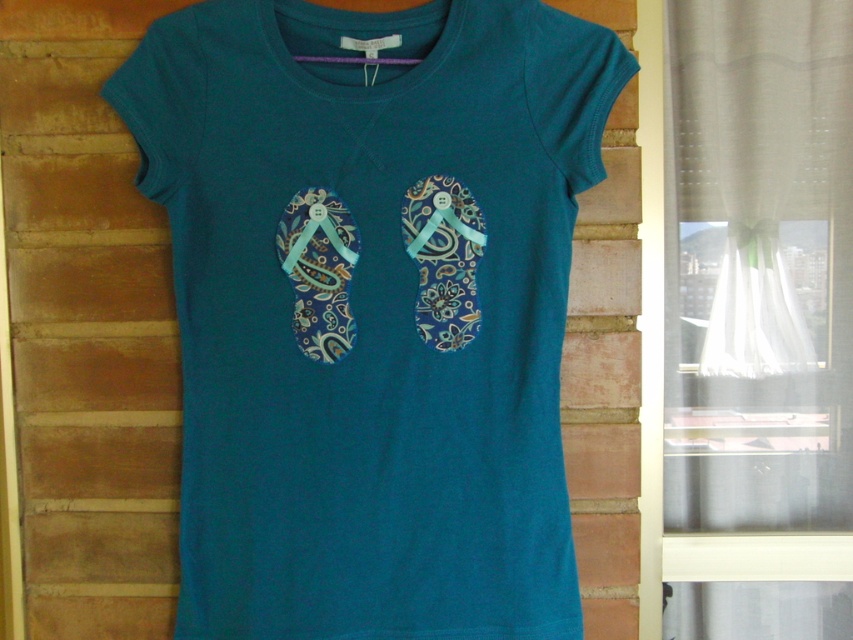
Question: Is teal fabric flip-flops at center positioned before purple fabric hanger at top?

Choices:
 (A) yes
 (B) no

Answer: (A)

Question: Which point is farther to the camera?

Choices:
 (A) (292, 42)
 (B) (370, 61)

Answer: (B)

Question: Can you confirm if teal fabric flip-flops at center is positioned below purple fabric hanger at top?

Choices:
 (A) yes
 (B) no

Answer: (A)

Question: Which point is closer to the camera?

Choices:
 (A) teal fabric flip-flops at center
 (B) purple fabric hanger at top

Answer: (A)

Question: Is teal fabric flip-flops at center smaller than purple fabric hanger at top?

Choices:
 (A) no
 (B) yes

Answer: (A)